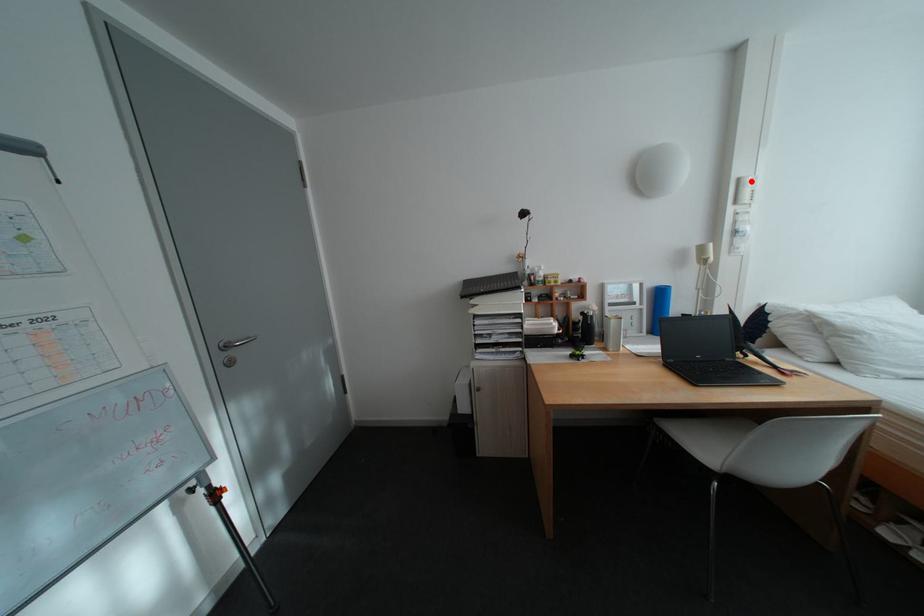
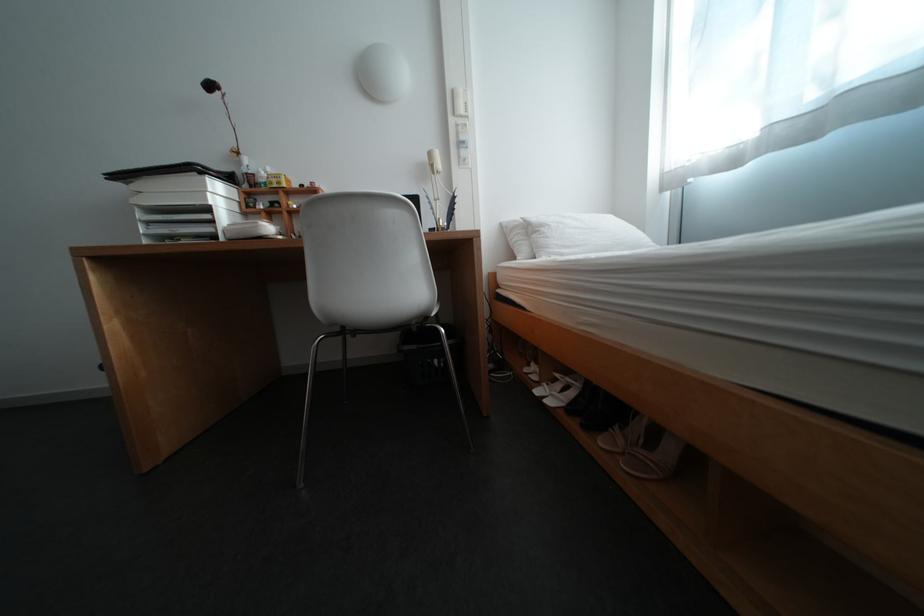
Question: I am providing you with two images of the same scene from different viewpoints. A red point is shown in image1. For the corresponding object point in image2, is it positioned nearer or farther from the camera?

Choices:
 (A) Nearer
 (B) Farther

Answer: (A)